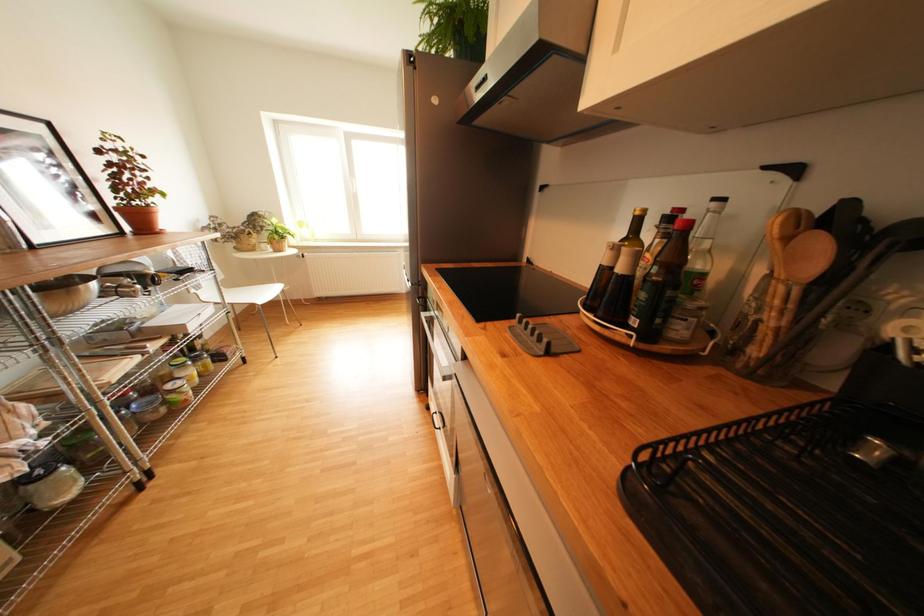
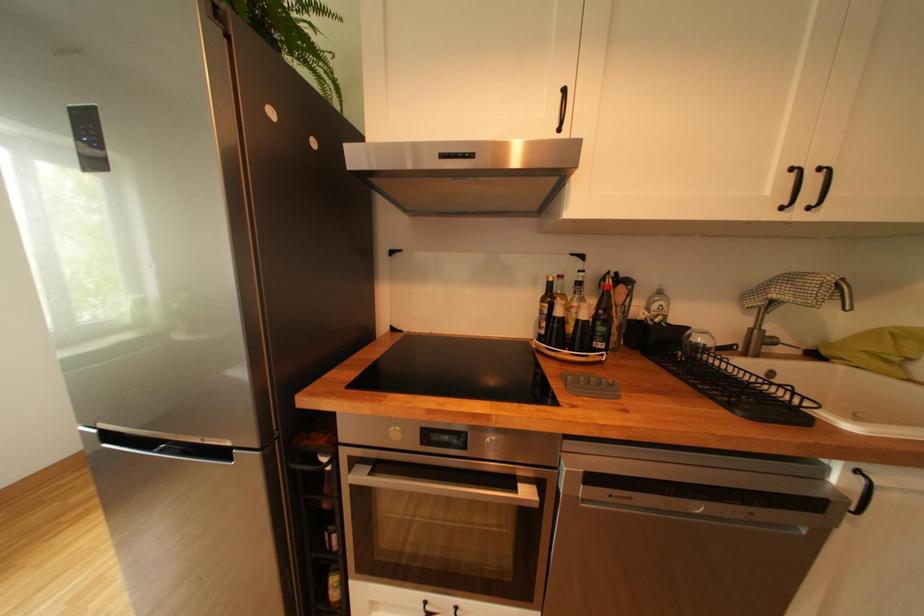
Question: How did the camera likely rotate?

Choices:
 (A) Left
 (B) Right
 (C) Up
 (D) Down

Answer: (B)